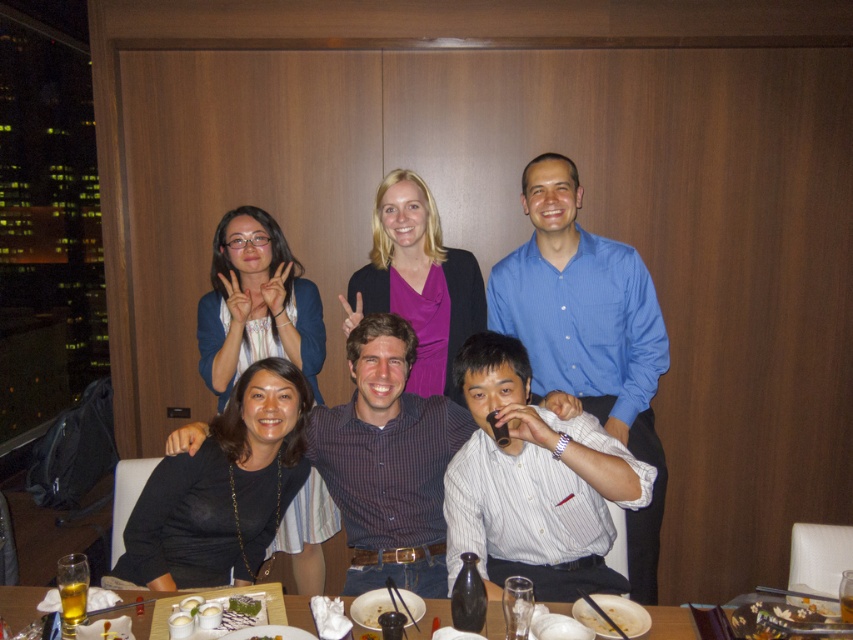
Looking at the scene, where is the purple matte shirt at center in relation to the white glossy bowl at lower center?

The purple matte shirt at center is to the right of the white glossy bowl at lower center.

You are a waiter trying to place a new dessert plate on the table. The dessert plate is 12 inches in diameter. You see the purple matte shirt at center and the white glossy bowl at lower center on the table. Can you determine if the dessert plate will fit between them without overlapping?

The purple matte shirt at center might be wider than the white glossy bowl at lower center, so the dessert plate might not fit between them. Check the actual distance first.

You are sitting at the table in the restaurant scene and want to reach both the point at (560, 204) and the point at (238, 604). Which point is closer to you?

The point at (238, 604) is closer to you because it is in front of the point at (560, 204).